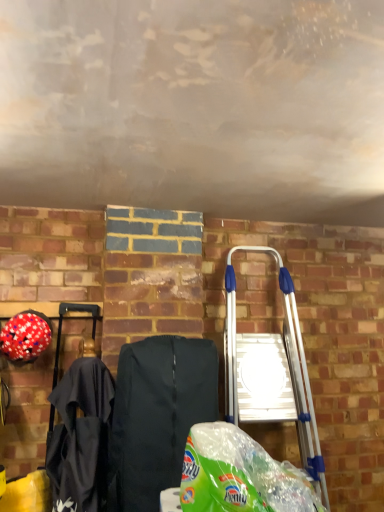
In order to click on black fabric folding chair at center in this screenshot , I will do `click(158, 414)`.

Measure the distance between point (x=196, y=444) and camera.

The depth of point (x=196, y=444) is 1.26 meters.

Locate an element on the screen. red matte helmet at left is located at coordinates click(x=25, y=337).

Which object is thinner, black fabric folding chair at center or red matte helmet at left?

Thinner between the two is red matte helmet at left.

Between black fabric folding chair at center and red matte helmet at left, which one has smaller size?

red matte helmet at left.

Consider the image. Which object is closer to the camera, black fabric folding chair at center or red matte helmet at left?

black fabric folding chair at center is in front.

Is black fabric folding chair at center oriented towards silver metallic ladder at right?

No, black fabric folding chair at center is not facing towards silver metallic ladder at right.

Which is more to the right, black fabric folding chair at center or silver metallic ladder at right?

silver metallic ladder at right.

What's the angular difference between black fabric folding chair at center and silver metallic ladder at right's facing directions?

0.821 degrees separate the facing orientations of black fabric folding chair at center and silver metallic ladder at right.

Are black fabric folding chair at center and silver metallic ladder at right far apart?

No, black fabric folding chair at center is not far away from silver metallic ladder at right.

Is silver metallic ladder at right in front of red matte helmet at left?

Yes, the depth of silver metallic ladder at right is less than that of red matte helmet at left.

From a real-world perspective, which is physically below, silver metallic ladder at right or red matte helmet at left?

silver metallic ladder at right, from a real-world perspective.

Is silver metallic ladder at right wider than red matte helmet at left?

Correct, the width of silver metallic ladder at right exceeds that of red matte helmet at left.

Is silver metallic ladder at right shorter than red matte helmet at left?

In fact, silver metallic ladder at right may be taller than red matte helmet at left.

Is red matte helmet at left with silver metallic ladder at right?

No, red matte helmet at left is not touching silver metallic ladder at right.

Is red matte helmet at left turned away from silver metallic ladder at right?

red matte helmet at left is not turned away from silver metallic ladder at right.

Considering the points (17, 362) and (225, 367), which point is in front, point (17, 362) or point (225, 367)?

Point (17, 362)

Locate an element on the screen. grocery bag on the right of black fabric folding chair at center is located at coordinates coord(239,475).

Can you confirm if black fabric folding chair at center is shorter than green plastic grocery bag at lower center?

No, black fabric folding chair at center is not shorter than green plastic grocery bag at lower center.

Is black fabric folding chair at center positioned beyond the bounds of green plastic grocery bag at lower center?

black fabric folding chair at center lies outside green plastic grocery bag at lower center's area.

Is point (196, 381) less distant than point (185, 486)?

No, it is behind (185, 486).

Is red matte helmet at left far away from black fabric folding chair at center?

red matte helmet at left is actually quite close to black fabric folding chair at center.

Is red matte helmet at left inside or outside of black fabric folding chair at center?

The correct answer is: outside.

Looking at their sizes, would you say red matte helmet at left is wider or thinner than black fabric folding chair at center?

Clearly, red matte helmet at left has less width compared to black fabric folding chair at center.

How many degrees apart are the facing directions of red matte helmet at left and black fabric folding chair at center?

1.64 degrees separate the facing orientations of red matte helmet at left and black fabric folding chair at center.

Can you tell me how much green plastic grocery bag at lower center and black fabric folding chair at center differ in facing direction?

The facing directions of green plastic grocery bag at lower center and black fabric folding chair at center are 1.02 degrees apart.

In the scene shown: From a real-world perspective, is green plastic grocery bag at lower center beneath black fabric folding chair at center?

Yes, from a real-world perspective, green plastic grocery bag at lower center is beneath black fabric folding chair at center.

Is green plastic grocery bag at lower center at the left side of black fabric folding chair at center?

No, green plastic grocery bag at lower center is not to the left of black fabric folding chair at center.

From the image's perspective, who appears lower, green plastic grocery bag at lower center or black fabric folding chair at center?

black fabric folding chair at center is shown below in the image.

Identify the location of helmet lying on the left of black fabric folding chair at center. The height and width of the screenshot is (512, 384). coord(25,337).

Find the location of `ladder that is behind the black fabric folding chair at center`. ladder that is behind the black fabric folding chair at center is located at coordinates (271, 373).

Based on their spatial positions, is green plastic grocery bag at lower center or black fabric folding chair at center closer to red matte helmet at left?

black fabric folding chair at center.

When comparing their distances from red matte helmet at left, does silver metallic ladder at right or black fabric folding chair at center seem closer?

Based on the image, black fabric folding chair at center appears to be nearer to red matte helmet at left.

Based on their spatial positions, is green plastic grocery bag at lower center or silver metallic ladder at right closer to red matte helmet at left?

green plastic grocery bag at lower center is closer to red matte helmet at left.

Estimate the real-world distances between objects in this image. Which object is closer to black fabric folding chair at center, green plastic grocery bag at lower center or silver metallic ladder at right?

green plastic grocery bag at lower center is closer to black fabric folding chair at center.

From the picture: When comparing their distances from green plastic grocery bag at lower center, does black fabric folding chair at center or silver metallic ladder at right seem closer?

Among the two, black fabric folding chair at center is located nearer to green plastic grocery bag at lower center.

From the image, which object appears to be nearer to black fabric folding chair at center, green plastic grocery bag at lower center or red matte helmet at left?

green plastic grocery bag at lower center lies closer to black fabric folding chair at center than the other object.

Considering their positions, is black fabric folding chair at center positioned further to red matte helmet at left than silver metallic ladder at right?

The object further to red matte helmet at left is silver metallic ladder at right.

Estimate the real-world distances between objects in this image. Which object is closer to silver metallic ladder at right, red matte helmet at left or black fabric folding chair at center?

black fabric folding chair at center lies closer to silver metallic ladder at right than the other object.

Locate an element on the screen. This screenshot has width=384, height=512. folding chair between green plastic grocery bag at lower center and silver metallic ladder at right in the front-back direction is located at coordinates (158, 414).

Where is `folding chair between red matte helmet at left and green plastic grocery bag at lower center from left to right`? The image size is (384, 512). folding chair between red matte helmet at left and green plastic grocery bag at lower center from left to right is located at coordinates (158, 414).

This screenshot has height=512, width=384. Find the location of `folding chair located between red matte helmet at left and silver metallic ladder at right in the left-right direction`. folding chair located between red matte helmet at left and silver metallic ladder at right in the left-right direction is located at coordinates (158, 414).

Identify the location of grocery bag located between red matte helmet at left and silver metallic ladder at right in the left-right direction. (239, 475).